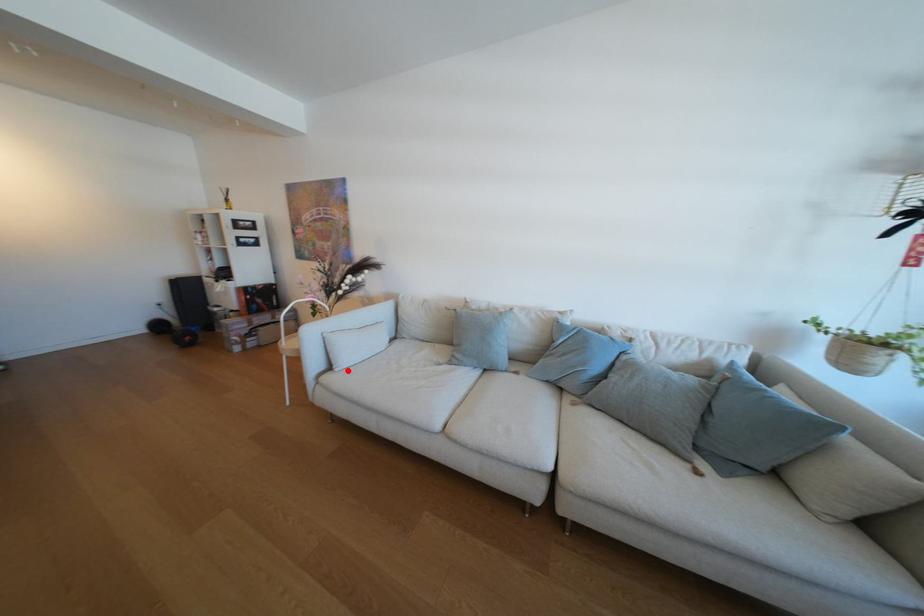
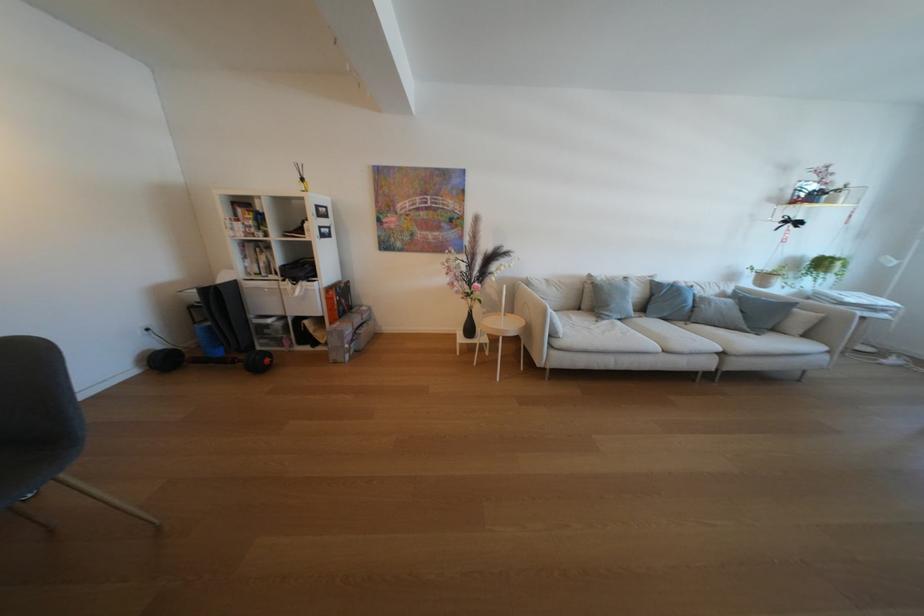
Find the pixel in the second image that matches the highlighted location in the first image.

(572, 338)